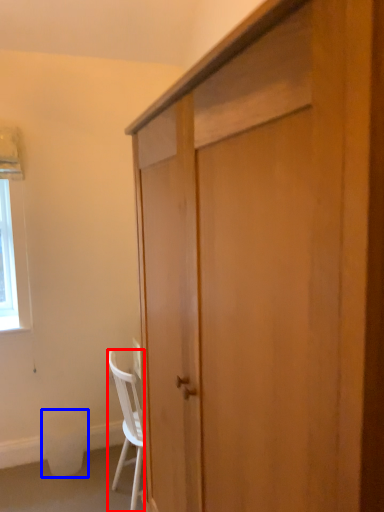
Question: Which of the following is the closest to the observer, chair (highlighted by a red box) or trash bin/can (highlighted by a blue box)?

Choices:
 (A) chair
 (B) trash bin/can

Answer: (A)